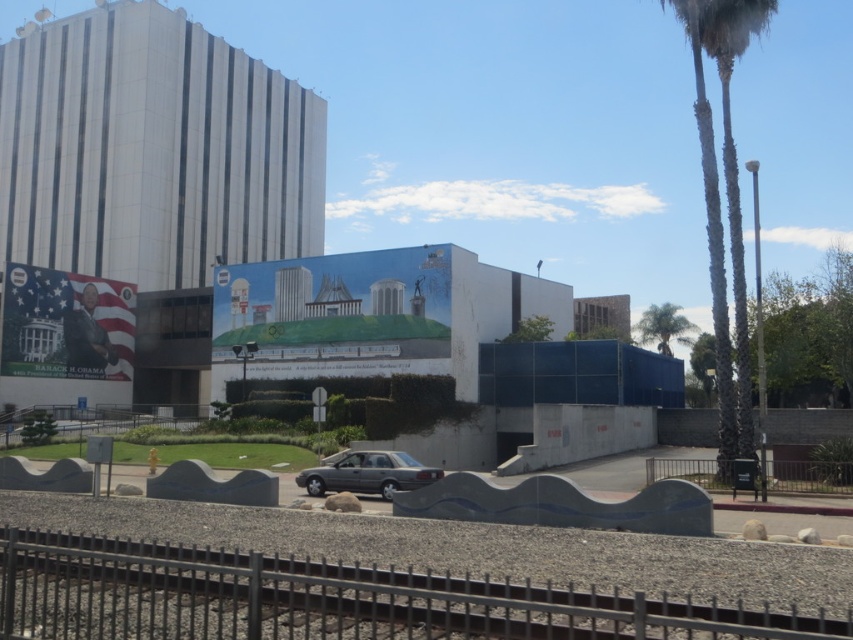
Question: Which of the following is the closest to the observer?

Choices:
 (A) green textured palm tree at right
 (B) satin silver sedan at center

Answer: (B)

Question: Where is metallic silver fence at lower right located in relation to green leafy palm tree at upper right in the image?

Choices:
 (A) left
 (B) right

Answer: (A)

Question: Can you confirm if green textured palm tree at right is positioned below satin silver sedan at center?

Choices:
 (A) yes
 (B) no

Answer: (B)

Question: Which of the following is the closest to the observer?

Choices:
 (A) black metal fence at lower center
 (B) satin silver sedan at center
 (C) metallic silver fence at lower right
 (D) green textured palm tree at right

Answer: (A)

Question: Which of the following is the closest to the observer?

Choices:
 (A) green textured palm tree at right
 (B) metallic silver fence at lower right
 (C) black metal fence at lower center
 (D) green leafy palm tree at upper right

Answer: (C)

Question: Can you confirm if green textured palm tree at right is positioned to the left of metallic silver fence at lower right?

Choices:
 (A) no
 (B) yes

Answer: (A)